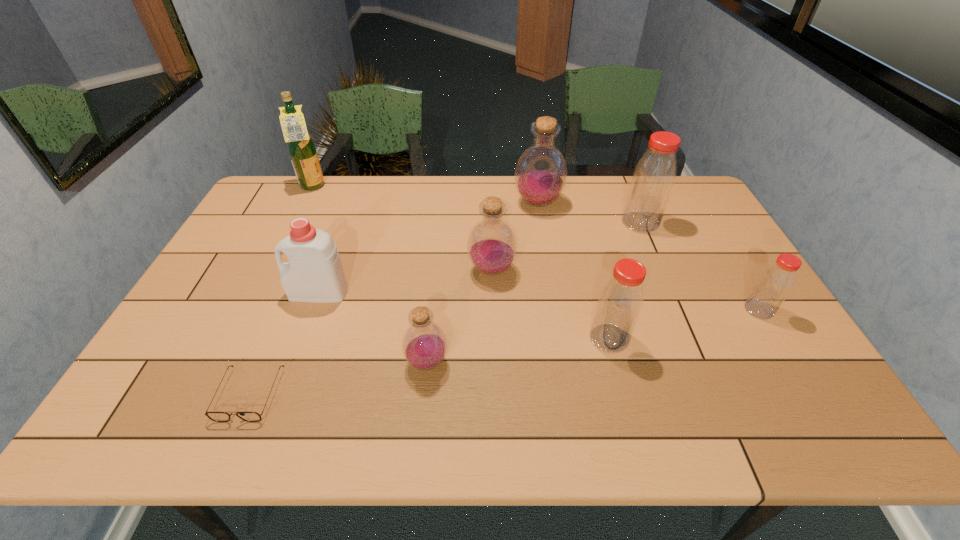
Locate an element on the screen. The image size is (960, 540). liquor is located at coordinates (302, 151).

At what (x,y) coordinates should I click in order to perform the action: click on the rightmost purple bottle. Please return your answer as a coordinate pair (x, y). The width and height of the screenshot is (960, 540). Looking at the image, I should click on (541, 172).

Identify the location of the farthest purple bottle. click(541, 172).

Find the location of a particular element. the second object from right to left is located at coordinates (654, 176).

Where is `the farthest red bottle`? The width and height of the screenshot is (960, 540). the farthest red bottle is located at coordinates (654, 176).

Find the location of a particular element. detergent is located at coordinates (314, 273).

Where is `the second smallest red bottle`? the second smallest red bottle is located at coordinates (620, 302).

Where is `the nearest red bottle`? The width and height of the screenshot is (960, 540). the nearest red bottle is located at coordinates (620, 302).

Where is `the second smallest purple bottle`? the second smallest purple bottle is located at coordinates (491, 246).

Locate an element on the screen. The width and height of the screenshot is (960, 540). the fifth object from right to left is located at coordinates (491, 246).